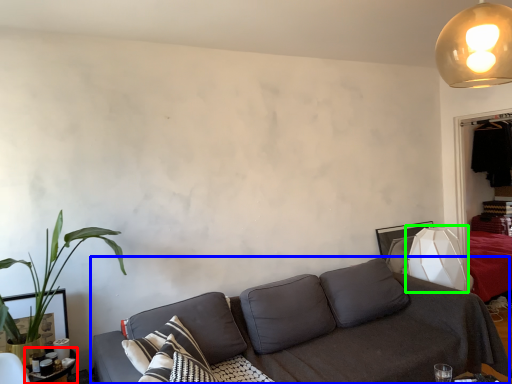
Question: Which object is positioned farthest from table (highlighted by a red box)? Select from studio couch (highlighted by a blue box) and table lamp (highlighted by a green box).

Choices:
 (A) studio couch
 (B) table lamp

Answer: (B)